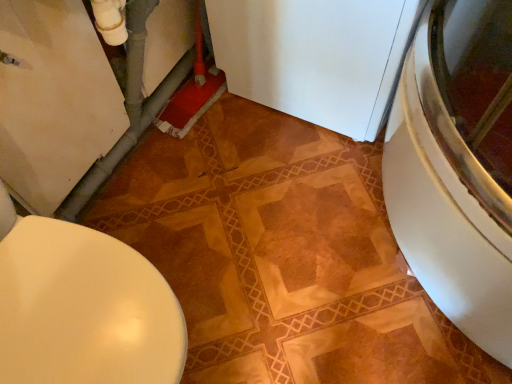
Question: Should I look upward or downward to see white matte refrigerator at center?

Choices:
 (A) down
 (B) up

Answer: (B)

Question: Is matte white toilet at lower left oriented away from white matte refrigerator at center?

Choices:
 (A) yes
 (B) no

Answer: (B)

Question: Is matte white toilet at lower left located outside white matte refrigerator at center?

Choices:
 (A) yes
 (B) no

Answer: (A)

Question: Is matte white toilet at lower left smaller than white matte refrigerator at center?

Choices:
 (A) yes
 (B) no

Answer: (A)

Question: Would you say matte white toilet at lower left contains white matte refrigerator at center?

Choices:
 (A) no
 (B) yes

Answer: (A)

Question: Does matte white toilet at lower left have a greater width compared to white matte refrigerator at center?

Choices:
 (A) no
 (B) yes

Answer: (A)

Question: Is matte white toilet at lower left thinner than white matte refrigerator at center?

Choices:
 (A) no
 (B) yes

Answer: (B)

Question: Is matte white toilet at lower left completely or partially inside white matte refrigerator at center?

Choices:
 (A) no
 (B) yes

Answer: (A)

Question: From the image's perspective, would you say white matte refrigerator at center is shown under matte white toilet at lower left?

Choices:
 (A) yes
 (B) no

Answer: (B)

Question: Considering the relative sizes of white matte refrigerator at center and matte white toilet at lower left in the image provided, is white matte refrigerator at center wider than matte white toilet at lower left?

Choices:
 (A) yes
 (B) no

Answer: (A)

Question: Is the position of white matte refrigerator at center more distant than that of matte white toilet at lower left?

Choices:
 (A) yes
 (B) no

Answer: (A)

Question: From a real-world perspective, is white matte refrigerator at center on matte white toilet at lower left?

Choices:
 (A) yes
 (B) no

Answer: (B)

Question: Considering the relative sizes of white matte refrigerator at center and matte white toilet at lower left in the image provided, is white matte refrigerator at center taller than matte white toilet at lower left?

Choices:
 (A) no
 (B) yes

Answer: (B)

Question: Does point (334, 74) appear closer or farther from the camera than point (54, 380)?

Choices:
 (A) farther
 (B) closer

Answer: (A)